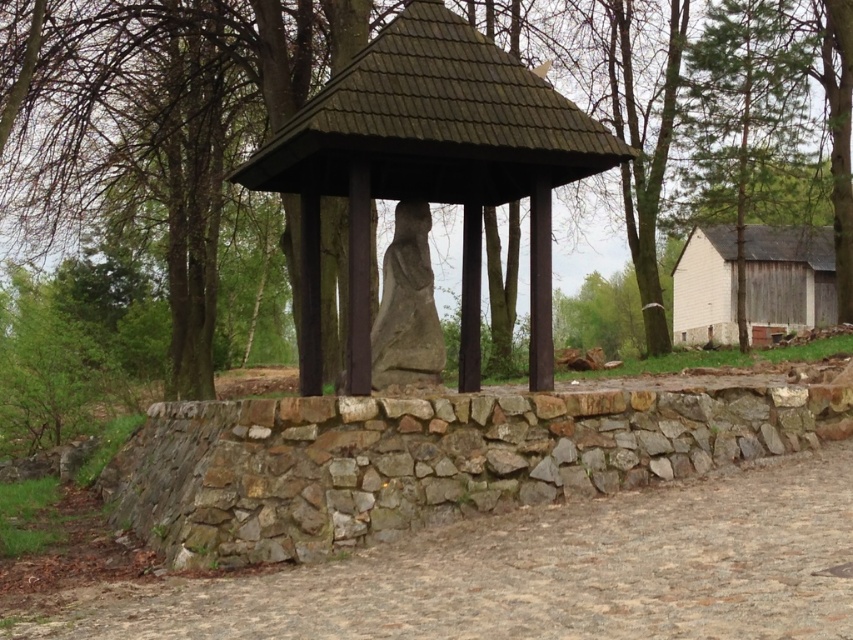
Who is more distant from viewer, (801, 573) or (253, 157)?

Point (253, 157)

From the picture: Does brown cobblestone path at center have a greater height compared to green leafy tree at center?

Incorrect, brown cobblestone path at center's height is not larger of green leafy tree at center's.

The width and height of the screenshot is (853, 640). I want to click on brown cobblestone path at center, so click(x=532, y=573).

Is brown wooden gazebo at center above green leafy tree at center?

No.

The image size is (853, 640). Describe the element at coordinates (428, 168) in the screenshot. I see `brown wooden gazebo at center` at that location.

Identify the location of brown wooden gazebo at center. The width and height of the screenshot is (853, 640). (428, 168).

Is brown cobblestone path at center closer to camera compared to brown wooden gazebo at center?

Yes, it is.

Between point (126, 582) and point (495, 157), which one is positioned behind?

Positioned behind is point (495, 157).

Identify the location of brown cobblestone path at center. The image size is (853, 640). (532, 573).